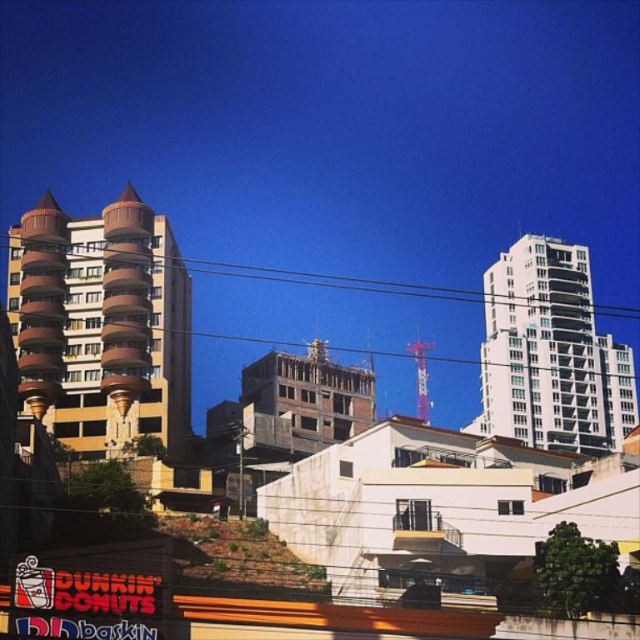
Is brown textured building at center-left above black wire at upper center?

No, brown textured building at center-left is not above black wire at upper center.

Does point (152, 289) lie in front of point (436, 292)?

Yes, point (152, 289) is closer to viewer.

The height and width of the screenshot is (640, 640). Find the location of `brown textured building at center-left`. brown textured building at center-left is located at coordinates (102, 326).

The image size is (640, 640). I want to click on white glass building at upper right, so click(x=550, y=353).

Is point (538, 288) positioned after point (384, 289)?

No, it is in front of (384, 289).

Between point (524, 380) and point (285, 272), which one is positioned in front?

Point (524, 380)

At what (x,y) coordinates should I click in order to perform the action: click on white glass building at upper right. Please return your answer as a coordinate pair (x, y). This screenshot has width=640, height=640. Looking at the image, I should click on (550, 353).

Between brown textured building at center-left and white glass building at upper right, which one is positioned higher?

brown textured building at center-left is above.

Looking at this image, can you confirm if brown textured building at center-left is taller than white glass building at upper right?

No.

What do you see at coordinates (102, 326) in the screenshot? I see `brown textured building at center-left` at bounding box center [102, 326].

Where is `brown textured building at center-left`? Image resolution: width=640 pixels, height=640 pixels. brown textured building at center-left is located at coordinates coord(102,326).